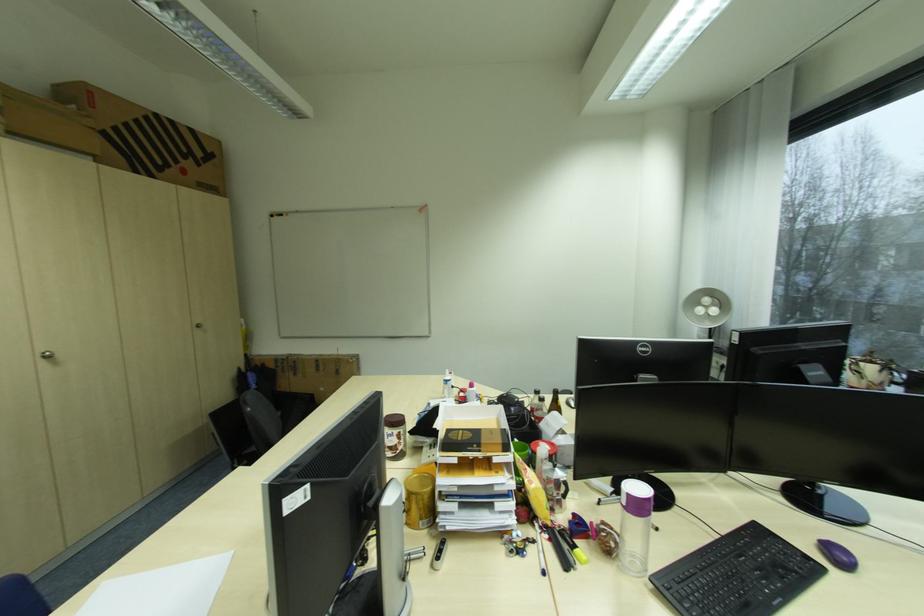
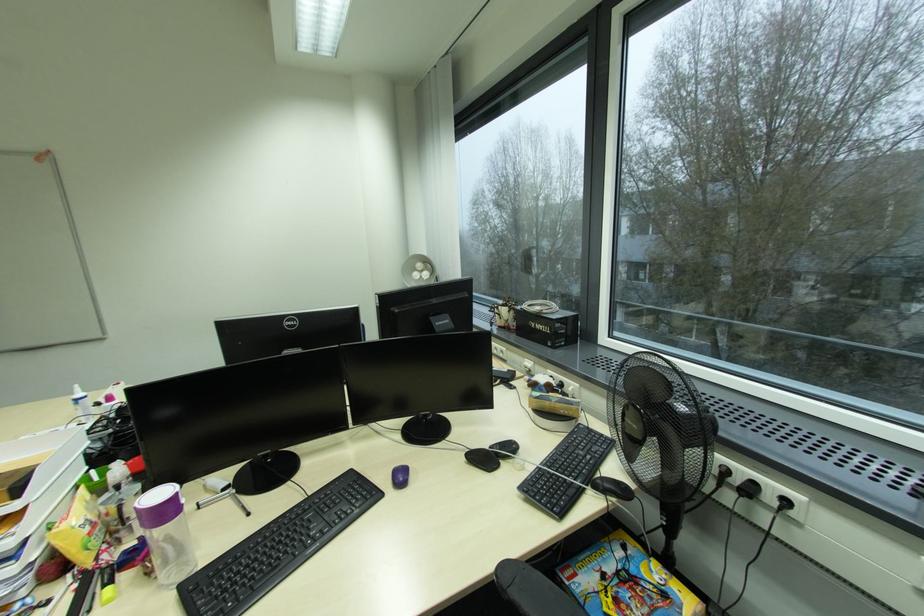
Question: Based on the continuous images, in which direction is the camera rotating? Reply with the corresponding letter.

Choices:
 (A) Left
 (B) Right
 (C) Up
 (D) Down

Answer: (B)